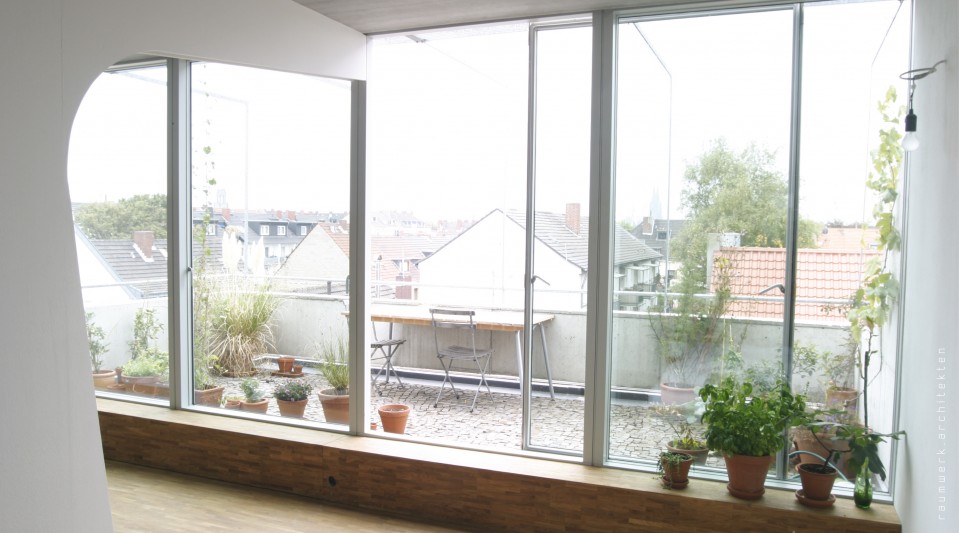
Where is `ceiling`? The height and width of the screenshot is (533, 959). ceiling is located at coordinates (414, 18).